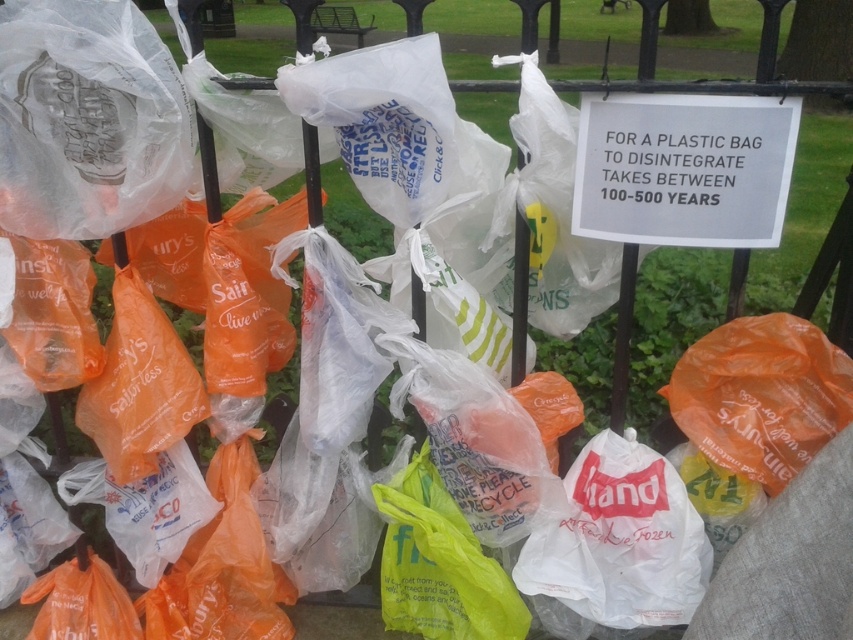
You are standing in the park and see the white paper sign at upper center and the translucent yellow plastic bag at center. Which object is nearer to you?

The white paper sign at upper center is closer to the viewer than the translucent yellow plastic bag at center.